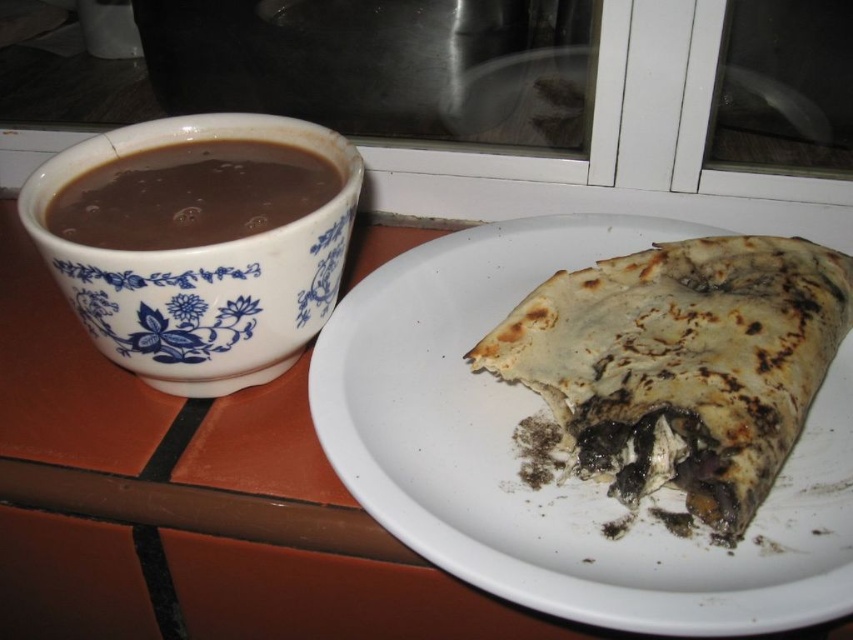
Identify the location of blue porcelain mug at left. (206, 259).

Does point (44, 198) come behind point (206, 227)?

No, (44, 198) is closer to viewer.

At what (x,y) coordinates should I click in order to perform the action: click on blue porcelain mug at left. Please return your answer as a coordinate pair (x, y). The height and width of the screenshot is (640, 853). Looking at the image, I should click on (206, 259).

Find the location of a particular element. The width and height of the screenshot is (853, 640). burnt tortilla at plate right is located at coordinates (682, 362).

Does burnt tortilla at plate right appear on the left side of blue porcelain mug at left?

No, burnt tortilla at plate right is not to the left of blue porcelain mug at left.

You are a GUI agent. You are given a task and a screenshot of the screen. Output one action in this format:
    pyautogui.click(x=<x>, y=<y>)
    Task: Click on the burnt tortilla at plate right
    The height and width of the screenshot is (640, 853).
    Given the screenshot: What is the action you would take?
    pyautogui.click(x=682, y=362)

Who is lower down, burnt tortilla at plate right or brown matte cup at left?

burnt tortilla at plate right

What do you see at coordinates (682, 362) in the screenshot?
I see `burnt tortilla at plate right` at bounding box center [682, 362].

The width and height of the screenshot is (853, 640). Identify the location of burnt tortilla at plate right. (682, 362).